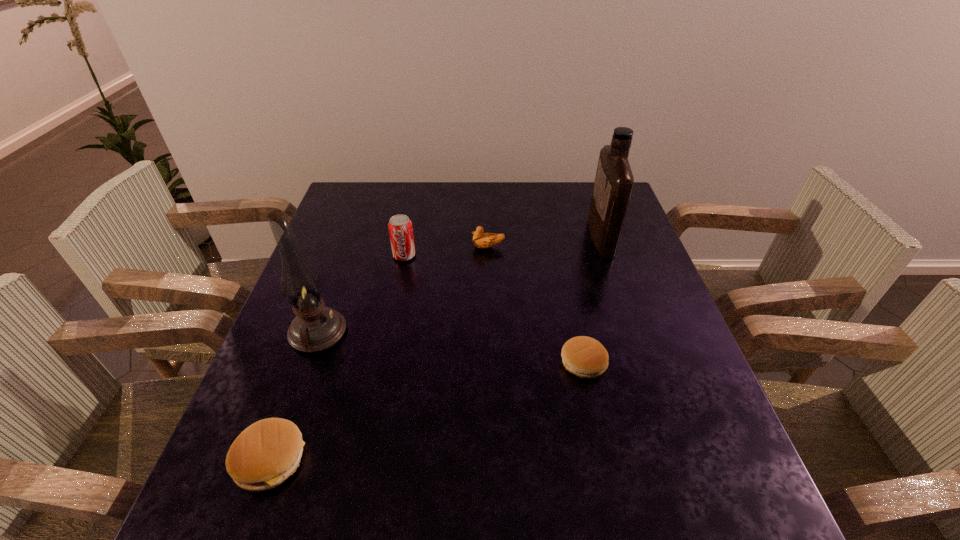
This screenshot has width=960, height=540. What are the coordinates of `vacant space that is in between the liquor and the third object from right to left` in the screenshot? It's located at (544, 242).

Find the location of `free space between the shorter patty and the third object from left to right`. free space between the shorter patty and the third object from left to right is located at coordinates (493, 309).

The width and height of the screenshot is (960, 540). I want to click on vacant area that lies between the oil lamp and the fourth shortest object, so click(x=361, y=294).

Locate an element on the screen. This screenshot has width=960, height=540. the third closest object to the nearest object is located at coordinates (585, 357).

Locate an element on the screen. The image size is (960, 540). object that is the second closest to the fourth object from left to right is located at coordinates (614, 181).

Where is `vacant space that satisfies the following two spatial constraints: 1. on the face of the third object from right to left; 2. on the logo side of the third object from left to right`? The height and width of the screenshot is (540, 960). vacant space that satisfies the following two spatial constraints: 1. on the face of the third object from right to left; 2. on the logo side of the third object from left to right is located at coordinates (489, 255).

Locate an element on the screen. vacant point that satisfies the following two spatial constraints: 1. on the label side of the rightmost object; 2. on the logo side of the third tallest object is located at coordinates (607, 255).

The image size is (960, 540). I want to click on vacant area in the image that satisfies the following two spatial constraints: 1. on the face of the third object from right to left; 2. on the left side of the shortest object, so click(491, 363).

Identify the location of vacant region that satisfies the following two spatial constraints: 1. on the label side of the rightmost object; 2. on the front side of the nearer patty. The image size is (960, 540). (676, 460).

Image resolution: width=960 pixels, height=540 pixels. I want to click on free region that satisfies the following two spatial constraints: 1. on the front side of the right patty; 2. on the right side of the oil lamp, so click(307, 363).